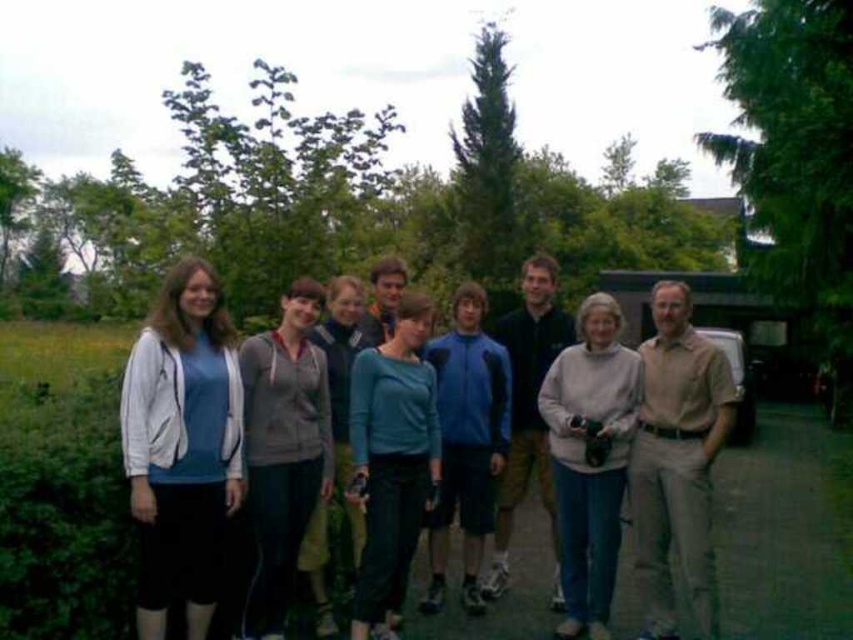
Based on the photo, you are standing at the camera position and want to take a photo of two specific points in the scene. The first point is at coordinates point (178,332) and the second is at point (212,532). Which point will appear closer to you in the photo?

Point (178,332) will appear closer to you in the photo because it is positioned in front of point (212,532) according to the spatial relationship provided.

You are a photographer trying to decide which of the two gray items at the center of the group to focus on. The matte gray hoodie at center and the light gray sweater at center. Which one is narrower in width?

The matte gray hoodie at center is thinner than the light gray sweater at center, so the matte gray hoodie at center is narrower in width.